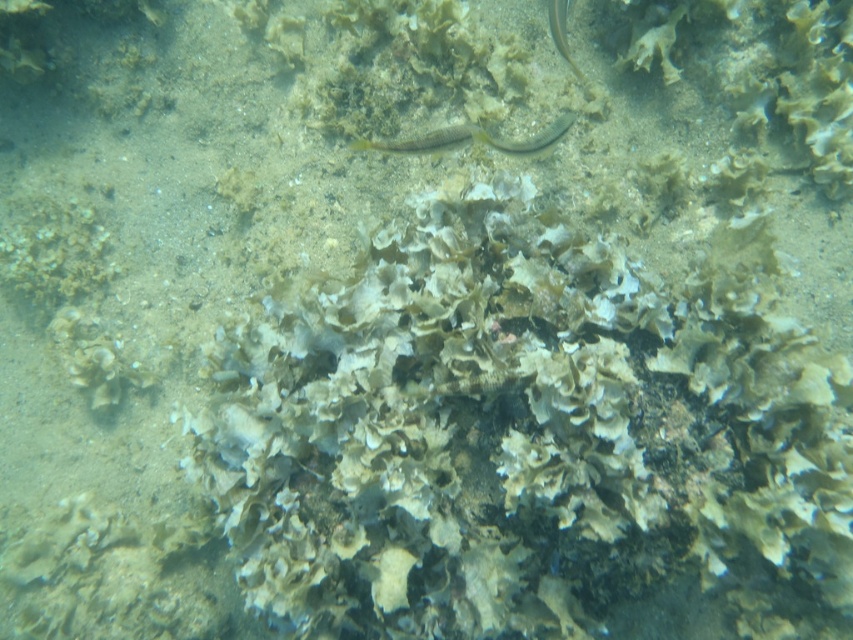
Question: Which point is closer to the camera taking this photo?

Choices:
 (A) (375, 141)
 (B) (560, 35)

Answer: (A)

Question: Which object is farther from the camera taking this photo?

Choices:
 (A) yellow-green translucent fish at center
 (B) translucent greenish-yellow fish at upper right

Answer: (B)

Question: Which object is closer to the camera taking this photo?

Choices:
 (A) translucent greenish-yellow fish at upper right
 (B) yellow-green translucent fish at center

Answer: (B)

Question: Is yellow-green translucent fish at center above translucent greenish-yellow fish at upper right?

Choices:
 (A) yes
 (B) no

Answer: (B)

Question: Is yellow-green translucent fish at center behind translucent greenish-yellow fish at upper right?

Choices:
 (A) no
 (B) yes

Answer: (A)

Question: Does yellow-green translucent fish at center appear over translucent greenish-yellow fish at upper right?

Choices:
 (A) no
 (B) yes

Answer: (A)